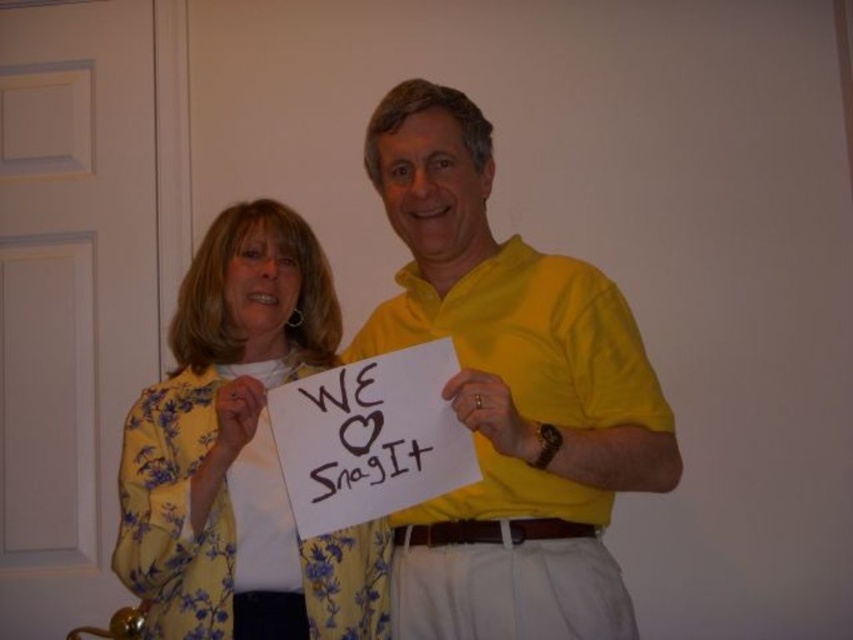
Question: Which object appears farthest from the camera in this image?

Choices:
 (A) yellow matte shirt at center
 (B) yellow floral blouse at center

Answer: (B)

Question: Which point appears closest to the camera in this image?

Choices:
 (A) (311, 625)
 (B) (393, 637)

Answer: (A)

Question: Can you confirm if yellow matte shirt at center is wider than yellow floral blouse at center?

Choices:
 (A) yes
 (B) no

Answer: (A)

Question: Does yellow matte shirt at center appear under yellow floral blouse at center?

Choices:
 (A) no
 (B) yes

Answer: (A)

Question: Does yellow matte shirt at center appear under yellow floral blouse at center?

Choices:
 (A) yes
 (B) no

Answer: (B)